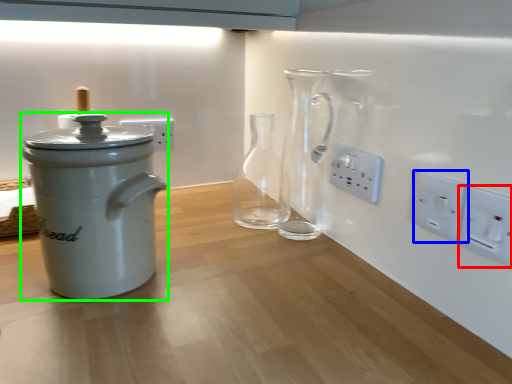
Question: Based on their relative distances, which object is farther from electric outlet (highlighted by a red box)? Choose from electric outlet (highlighted by a blue box) and kitchen appliance (highlighted by a green box).

Choices:
 (A) electric outlet
 (B) kitchen appliance

Answer: (B)